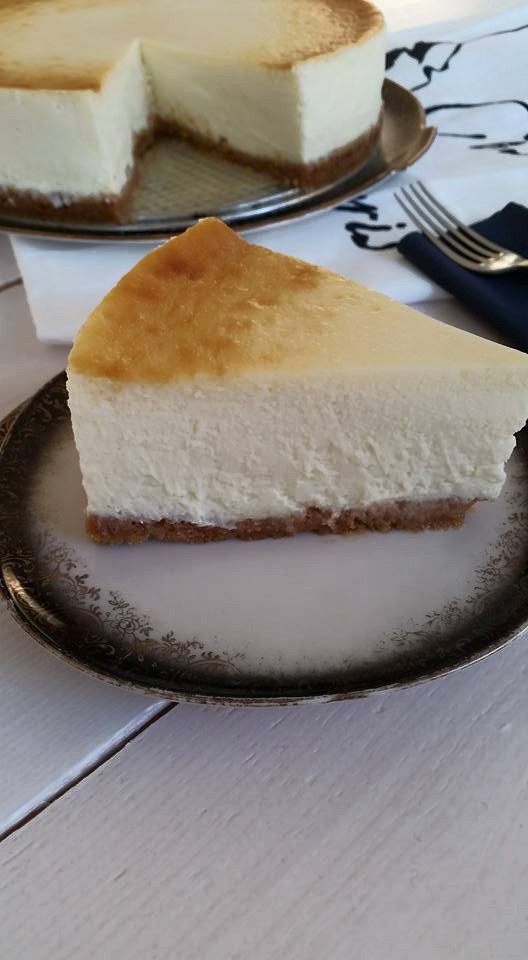
This screenshot has width=528, height=960. What are the coordinates of `fork` in the screenshot? It's located at (444, 216).